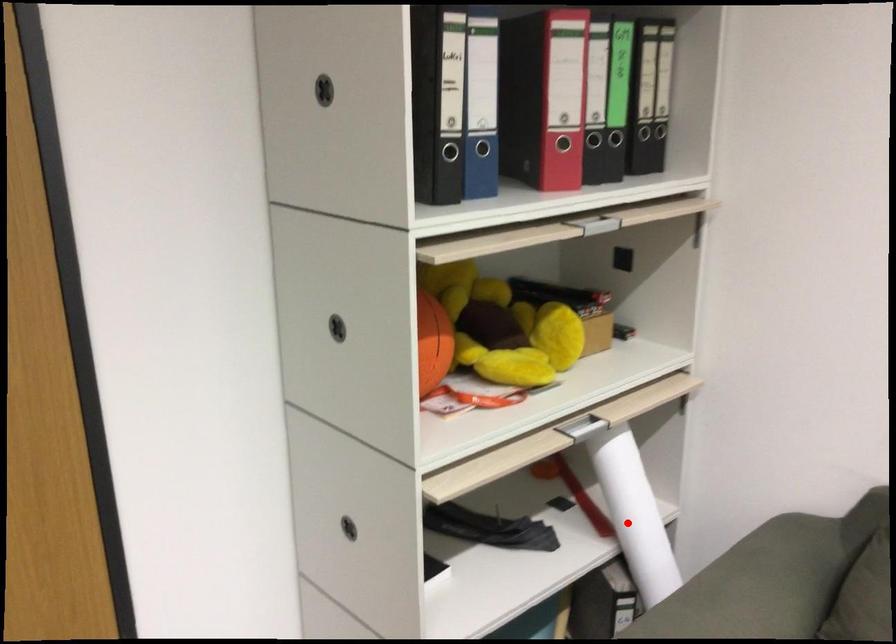
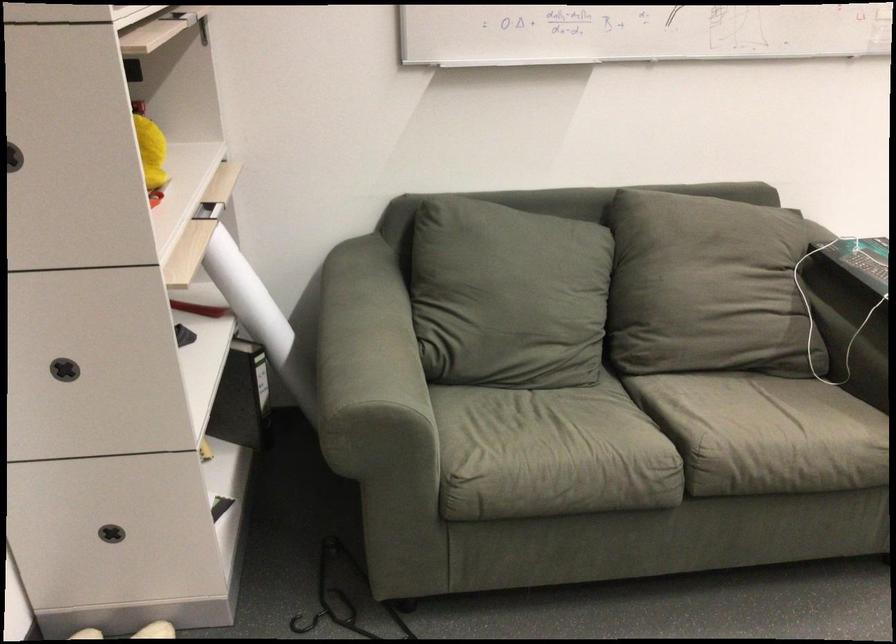
Question: I am providing you with two images of the same scene from different viewpoints. Given a red point in image1, look at the same physical point in image2. Is it:

Choices:
 (A) Closer to the viewpoint
 (B) Farther from the viewpoint

Answer: (B)